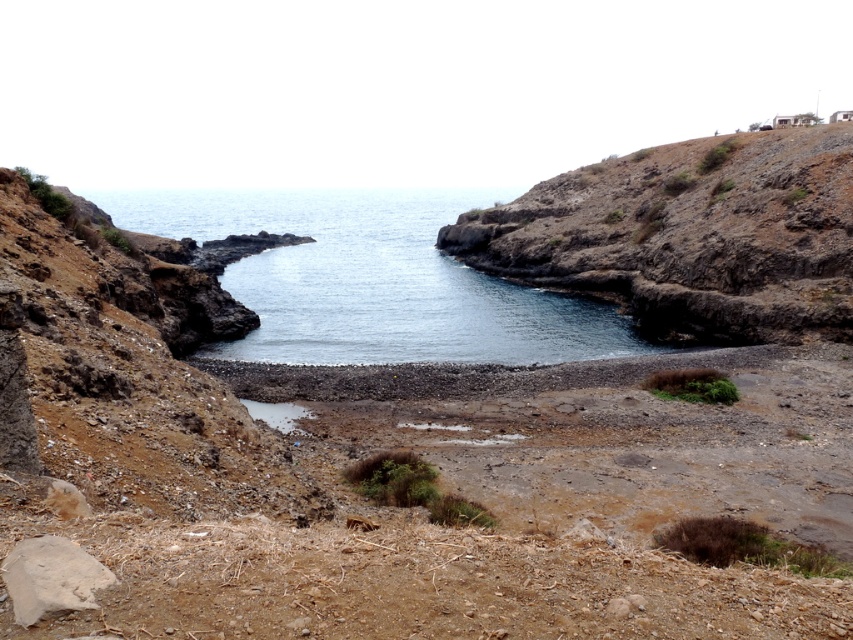
Question: Which object is the closest to the dull brown rock at upper right?

Choices:
 (A) dull brown dirt at left
 (B) clear water at center

Answer: (A)

Question: Which point appears farthest from the camera in this image?

Choices:
 (A) (625, 307)
 (B) (96, 588)
 (C) (260, 337)
 (D) (86, 218)

Answer: (A)

Question: Is dull brown dirt at left smaller than dull brown rock at upper right?

Choices:
 (A) no
 (B) yes

Answer: (A)

Question: Does dull brown dirt at left appear over clear water at center?

Choices:
 (A) yes
 (B) no

Answer: (B)

Question: Does dull brown dirt at left appear over brown rough rock at lower left?

Choices:
 (A) no
 (B) yes

Answer: (B)

Question: Which point is farther from the camera taking this photo?

Choices:
 (A) (56, 438)
 (B) (42, 612)

Answer: (A)